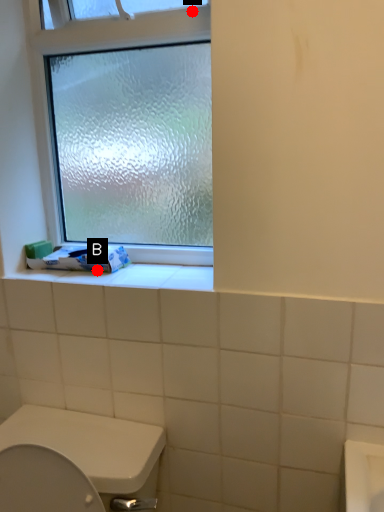
Question: Two points are circled on the image, labeled by A and B beside each circle. Which point is farther from the camera taking this photo?

Choices:
 (A) A is further
 (B) B is further

Answer: (B)